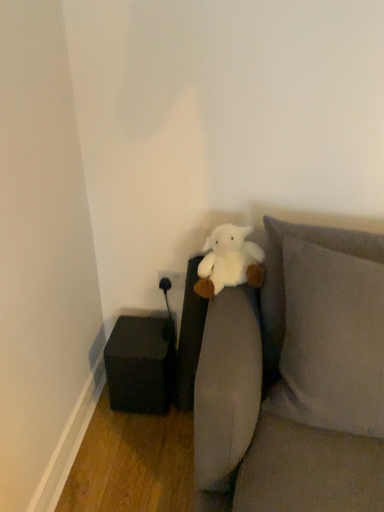
This screenshot has height=512, width=384. What do you see at coordinates (140, 364) in the screenshot?
I see `black matte cube at lower left` at bounding box center [140, 364].

What are the coordinates of `black matte cube at lower left` in the screenshot? It's located at (140, 364).

Locate an element on the screen. The image size is (384, 512). black matte cube at lower left is located at coordinates (140, 364).

From the image's perspective, who appears lower, white plush at center or black matte cube at lower left?

black matte cube at lower left.

Is point (242, 269) closer to camera compared to point (151, 337)?

Yes.

Is white plush at center surrounding black matte cube at lower left?

No, black matte cube at lower left is located outside of white plush at center.

Where is `teddy bear that is on the right side of black matte cube at lower left`? The height and width of the screenshot is (512, 384). teddy bear that is on the right side of black matte cube at lower left is located at coordinates (229, 261).

In terms of size, does soft gray fabric couch at center appear bigger or smaller than black matte cube at lower left?

Considering their sizes, soft gray fabric couch at center takes up more space than black matte cube at lower left.

Which of these two, soft gray fabric couch at center or black matte cube at lower left, stands shorter?

black matte cube at lower left is shorter.

From the picture: Is black matte cube at lower left a part of soft gray fabric couch at center?

No, black matte cube at lower left is not surrounded by soft gray fabric couch at center.

Does soft gray fabric couch at center turn towards black matte cube at lower left?

No, soft gray fabric couch at center does not turn towards black matte cube at lower left.

Is soft gray fabric couch at center not within white plush at center?

soft gray fabric couch at center is positioned outside white plush at center.

Considering the relative sizes of soft gray fabric couch at center and white plush at center in the image provided, is soft gray fabric couch at center wider than white plush at center?

Yes.

From a real-world perspective, is soft gray fabric couch at center under white plush at center?

Yes, from a real-world perspective, soft gray fabric couch at center is under white plush at center.

Image resolution: width=384 pixels, height=512 pixels. I want to click on studio couch below the white plush at center (from a real-world perspective), so click(295, 380).

Based on the photo, is white plush at center positioned beyond the bounds of soft gray fabric couch at center?

Actually, white plush at center is within soft gray fabric couch at center.

Is white plush at center to the left of soft gray fabric couch at center from the viewer's perspective?

Yes, white plush at center is to the left of soft gray fabric couch at center.

Considering the sizes of objects white plush at center and soft gray fabric couch at center in the image provided, who is shorter, white plush at center or soft gray fabric couch at center?

Standing shorter between the two is white plush at center.

Considering the relative positions of black matte cube at lower left and white plush at center in the image provided, is black matte cube at lower left to the left or to the right of white plush at center?

Based on their positions, black matte cube at lower left is located to the left of white plush at center.

Are black matte cube at lower left and white plush at center located far from each other?

Actually, black matte cube at lower left and white plush at center are a little close together.

Is point (143, 407) closer to viewer compared to point (238, 234)?

That is False.

Considering the positions of objects black matte cube at lower left and white plush at center in the image provided, who is in front, black matte cube at lower left or white plush at center?

white plush at center is closer to the camera.

Which is in front, point (139, 386) or point (242, 455)?

Point (242, 455)

Considering the relative sizes of black matte cube at lower left and soft gray fabric couch at center in the image provided, is black matte cube at lower left bigger than soft gray fabric couch at center?

Incorrect, black matte cube at lower left is not larger than soft gray fabric couch at center.

From a real-world perspective, is black matte cube at lower left located higher than soft gray fabric couch at center?

Actually, black matte cube at lower left is physically below soft gray fabric couch at center in the real world.

Is black matte cube at lower left wider than soft gray fabric couch at center?

Incorrect, the width of black matte cube at lower left does not surpass that of soft gray fabric couch at center.

Where is `teddy bear on the right of black matte cube at lower left`? teddy bear on the right of black matte cube at lower left is located at coordinates (229, 261).

In order to click on studio couch above the black matte cube at lower left (from a real-world perspective) in this screenshot , I will do `click(295, 380)`.

Looking at this image, looking at the image, which one is located further to soft gray fabric couch at center, black matte cube at lower left or white plush at center?

black matte cube at lower left is positioned further to the anchor soft gray fabric couch at center.

Based on their spatial positions, is soft gray fabric couch at center or white plush at center further from black matte cube at lower left?

The object further to black matte cube at lower left is soft gray fabric couch at center.

Looking at the image, which one is located closer to white plush at center, soft gray fabric couch at center or black matte cube at lower left?

The object closer to white plush at center is soft gray fabric couch at center.

Looking at the image, which one is located further to soft gray fabric couch at center, white plush at center or black matte cube at lower left?

Among the two, black matte cube at lower left is located further to soft gray fabric couch at center.

Looking at the image, which one is located further to black matte cube at lower left, white plush at center or soft gray fabric couch at center?

soft gray fabric couch at center lies further to black matte cube at lower left than the other object.

When comparing their distances from white plush at center, does black matte cube at lower left or soft gray fabric couch at center seem further?

black matte cube at lower left.

Where is `teddy bear located between soft gray fabric couch at center and black matte cube at lower left in the depth direction`? This screenshot has height=512, width=384. teddy bear located between soft gray fabric couch at center and black matte cube at lower left in the depth direction is located at coordinates point(229,261).